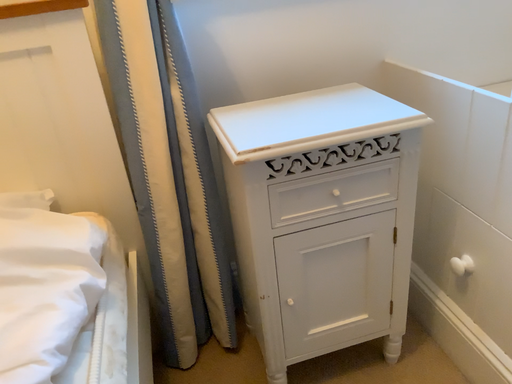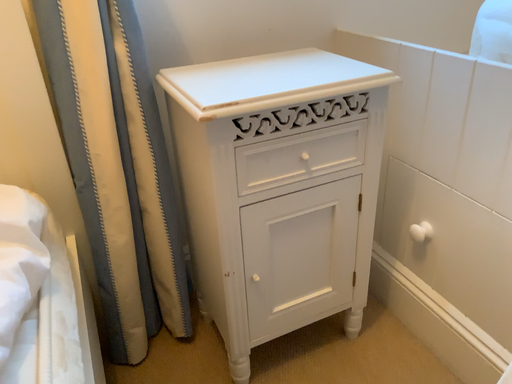
Question: How did the camera likely rotate when shooting the video?

Choices:
 (A) rotated left
 (B) rotated right

Answer: (B)